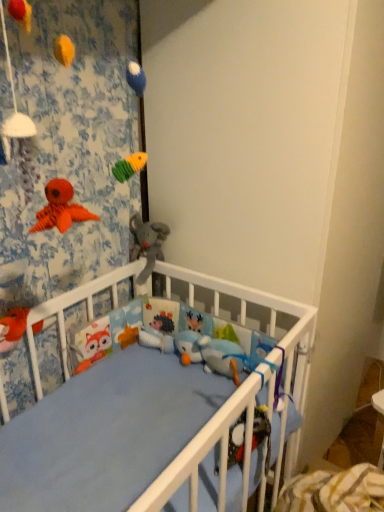
Question: Considering the positions of point (8, 314) and point (162, 333), is point (8, 314) closer or farther from the camera than point (162, 333)?

Choices:
 (A) farther
 (B) closer

Answer: (B)

Question: Is fluffy orange fox at lower left, acting as the 2th toy starting from the bottom, taller or shorter than white plush hedgehog at center, which appears as the first toy when viewed from the back?

Choices:
 (A) tall
 (B) short

Answer: (A)

Question: Based on their relative distances, which object is farther from the white plush hedgehog at center, positioned as the 1th toy in right-to-left order?

Choices:
 (A) white matte wall at upper center
 (B) soft plush elephant at center, which is counted as the second toy, starting from the back
 (C) fluffy orange fox at lower left, which is the 3th toy in back-to-front order

Answer: (A)

Question: Which of these objects is positioned closest to the fluffy orange fox at lower left, positioned as the 1th toy in front-to-back order?

Choices:
 (A) soft plush elephant at center, which ranks as the third toy in bottom-to-top order
 (B) white plush hedgehog at center, placed as the 3th toy when sorted from top to bottom
 (C) white matte wall at upper center

Answer: (B)